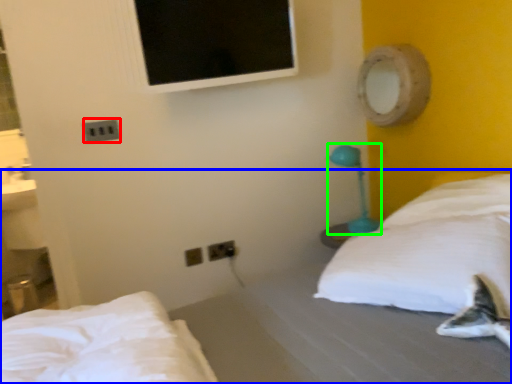
Question: Which object is positioned farthest from electric outlet (highlighted by a red box)? Select from bed (highlighted by a blue box) and table lamp (highlighted by a green box).

Choices:
 (A) bed
 (B) table lamp

Answer: (B)